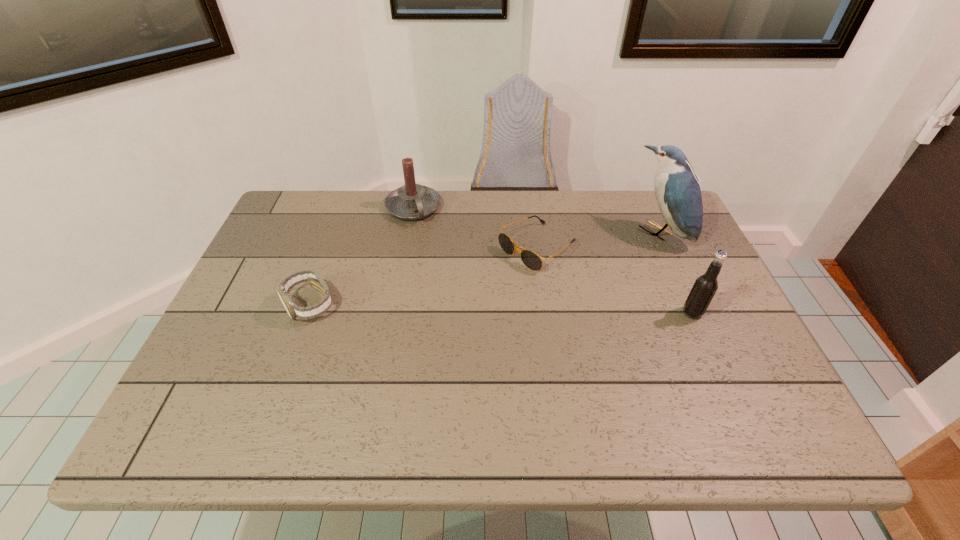
Identify the location of free space at the near right corner of the desktop. (756, 366).

You are a GUI agent. You are given a task and a screenshot of the screen. Output one action in this format:
    pyautogui.click(x=<x>, y=<y>)
    Task: Click on the free space between the third object from left to right and the candle
    Image resolution: width=960 pixels, height=540 pixels.
    Given the screenshot: What is the action you would take?
    pyautogui.click(x=475, y=228)

The width and height of the screenshot is (960, 540). I want to click on free area in between the root beer and the shortest object, so click(614, 280).

I want to click on free spot between the tallest object and the root beer, so click(676, 273).

You are a GUI agent. You are given a task and a screenshot of the screen. Output one action in this format:
    pyautogui.click(x=<x>, y=<y>)
    Task: Click on the empty space that is in between the leftmost object and the root beer
    The height and width of the screenshot is (540, 960).
    Given the screenshot: What is the action you would take?
    pyautogui.click(x=501, y=309)

You are a GUI agent. You are given a task and a screenshot of the screen. Output one action in this format:
    pyautogui.click(x=<x>, y=<y>)
    Task: Click on the free space between the tallest object and the fourth object from right to left
    This screenshot has width=960, height=540.
    Given the screenshot: What is the action you would take?
    pyautogui.click(x=537, y=220)

Where is `free point between the root beer and the second object from left to right`? The width and height of the screenshot is (960, 540). free point between the root beer and the second object from left to right is located at coordinates (553, 261).

At what (x,y) coordinates should I click in order to perform the action: click on free space between the root beer and the candle. Please return your answer as a coordinate pair (x, y). This screenshot has height=540, width=960. Looking at the image, I should click on (553, 261).

Locate an element on the screen. free space between the leftmost object and the shortest object is located at coordinates (423, 276).

Locate an element on the screen. vacant area between the shortest object and the candle is located at coordinates click(475, 228).